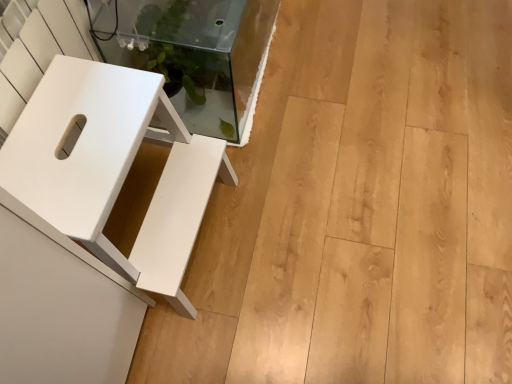
Where is `vacant space to the right of transparent glass table at upper left`? vacant space to the right of transparent glass table at upper left is located at coordinates (343, 71).